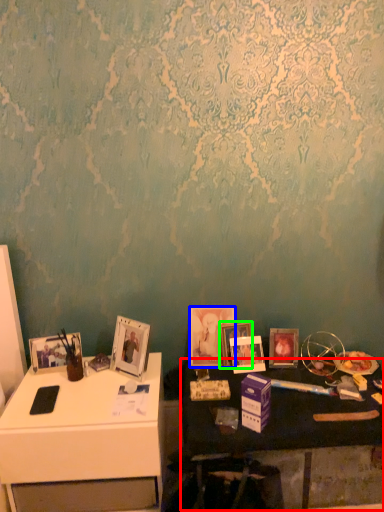
Question: Estimate the real-world distances between objects in this image. Which object is farther from table (highlighted by a red box), picture frame (highlighted by a blue box) or picture frame (highlighted by a green box)?

Choices:
 (A) picture frame
 (B) picture frame

Answer: (B)